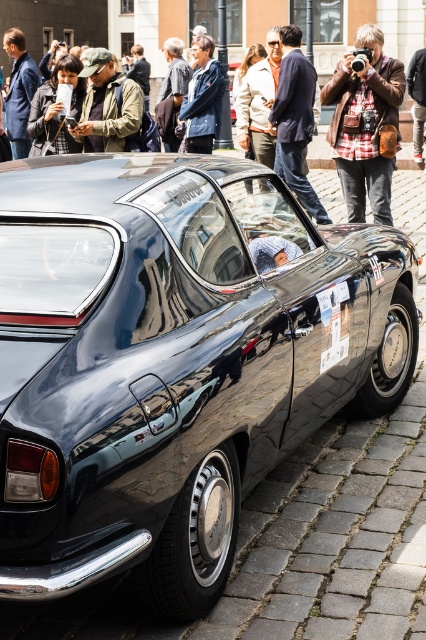
Which is above, shiny black car at center or matte black car at center?

matte black car at center

Is shiny black car at center bigger than matte black car at center?

Incorrect, shiny black car at center is not larger than matte black car at center.

The width and height of the screenshot is (426, 640). What do you see at coordinates (173, 360) in the screenshot?
I see `shiny black car at center` at bounding box center [173, 360].

The image size is (426, 640). In order to click on shiny black car at center in this screenshot , I will do `click(173, 360)`.